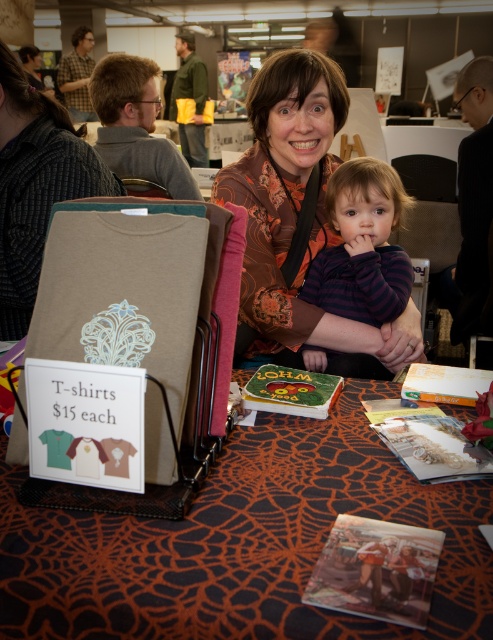
Question: Which point appears closest to the camera in this image?

Choices:
 (A) (282, 353)
 (B) (364, 321)
 (C) (12, 592)

Answer: (C)

Question: Which point is closer to the camera?

Choices:
 (A) orange spiderweb fabric at center
 (B) matte orange blouse at center
 (C) purple striped sweater at center

Answer: (A)

Question: Which object is the closest to the purple striped sweater at center?

Choices:
 (A) matte orange blouse at center
 (B) orange spiderweb fabric at center

Answer: (A)

Question: Does orange spiderweb fabric at center have a larger size compared to purple striped sweater at center?

Choices:
 (A) yes
 (B) no

Answer: (A)

Question: From the image, what is the correct spatial relationship of matte orange blouse at center in relation to purple striped sweater at center?

Choices:
 (A) above
 (B) below

Answer: (A)

Question: Is matte orange blouse at center further to the viewer compared to purple striped sweater at center?

Choices:
 (A) yes
 (B) no

Answer: (B)